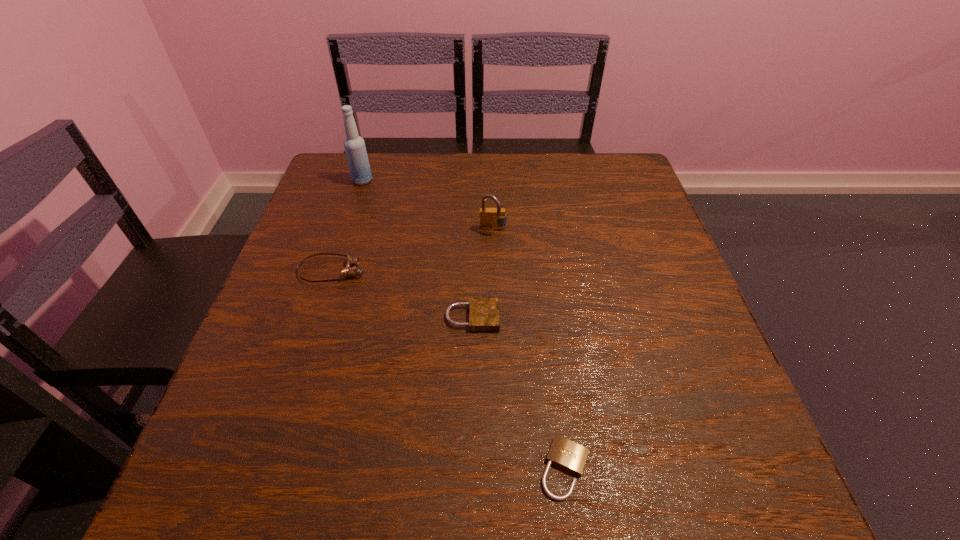
The image size is (960, 540). What are the coordinates of `the farthest object` in the screenshot? It's located at (354, 145).

Find the location of a particular element. the tallest object is located at coordinates (354, 145).

Locate an element on the screen. The width and height of the screenshot is (960, 540). the fourth shortest object is located at coordinates (490, 218).

The height and width of the screenshot is (540, 960). I want to click on the farthest padlock, so click(x=490, y=218).

The width and height of the screenshot is (960, 540). In order to click on goggles in this screenshot , I will do `click(347, 271)`.

This screenshot has height=540, width=960. I want to click on the third farthest object, so click(x=347, y=271).

Find the location of a particular element. Image resolution: width=960 pixels, height=540 pixels. the second nearest object is located at coordinates (483, 311).

Identify the location of the second farthest padlock. This screenshot has height=540, width=960. (483, 311).

Where is `the rightmost object`? This screenshot has width=960, height=540. the rightmost object is located at coordinates (564, 453).

Locate an element on the screen. This screenshot has width=960, height=540. the nearest object is located at coordinates (564, 453).